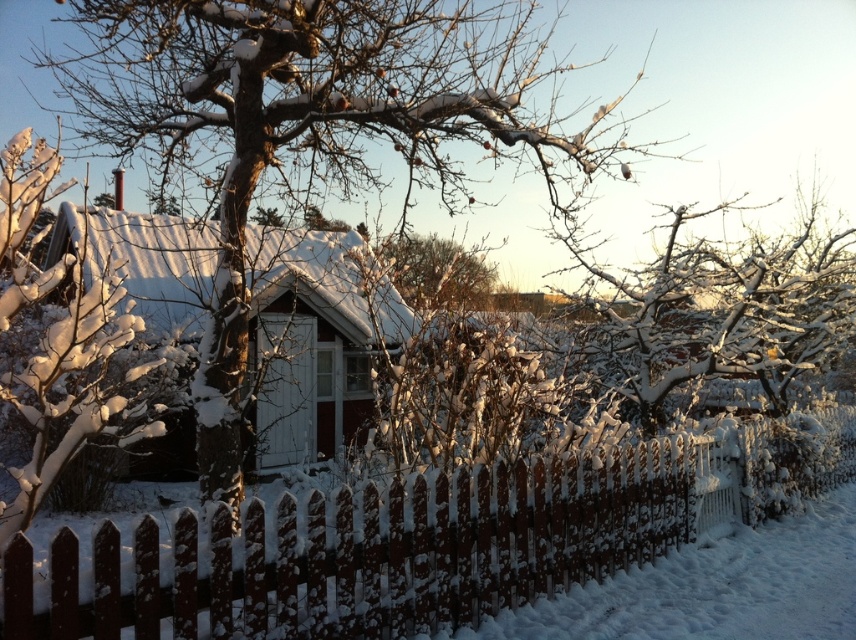
You are standing in the winter scene and want to place a small decoration exactly halfway between point [366,435] and point [110,365]. Which direction should you move from the closer point to reach the halfway point?

The point closer to you is point [110,365]. To reach the halfway point between point [366,435] and point [110,365], you should move towards the direction of point [366,435] from point [110,365].